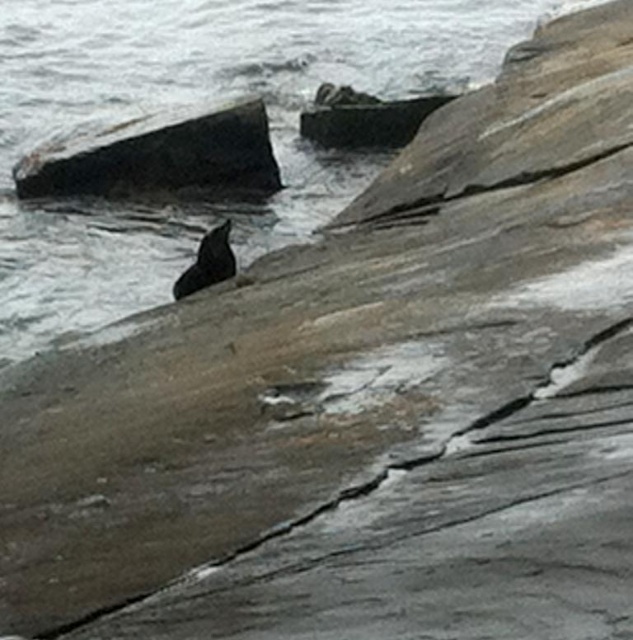
Question: Which point is closer to the camera?

Choices:
 (A) smooth gray rock at upper center
 (B) smooth black seal at center

Answer: (B)

Question: Which point appears farthest from the camera in this image?

Choices:
 (A) (211, 260)
 (B) (339, 100)
 (C) (154, 163)

Answer: (B)

Question: Is smooth gray rock at upper center bigger than smooth black seal at center?

Choices:
 (A) no
 (B) yes

Answer: (B)

Question: Does smooth dark gray rock at upper left have a greater width compared to smooth black seal at center?

Choices:
 (A) yes
 (B) no

Answer: (A)

Question: In this image, where is smooth dark gray rock at upper left located relative to smooth gray rock at upper center?

Choices:
 (A) below
 (B) above

Answer: (A)

Question: Which point is farther to the camera?

Choices:
 (A) (229, 228)
 (B) (54, 188)
 (C) (301, 134)

Answer: (C)